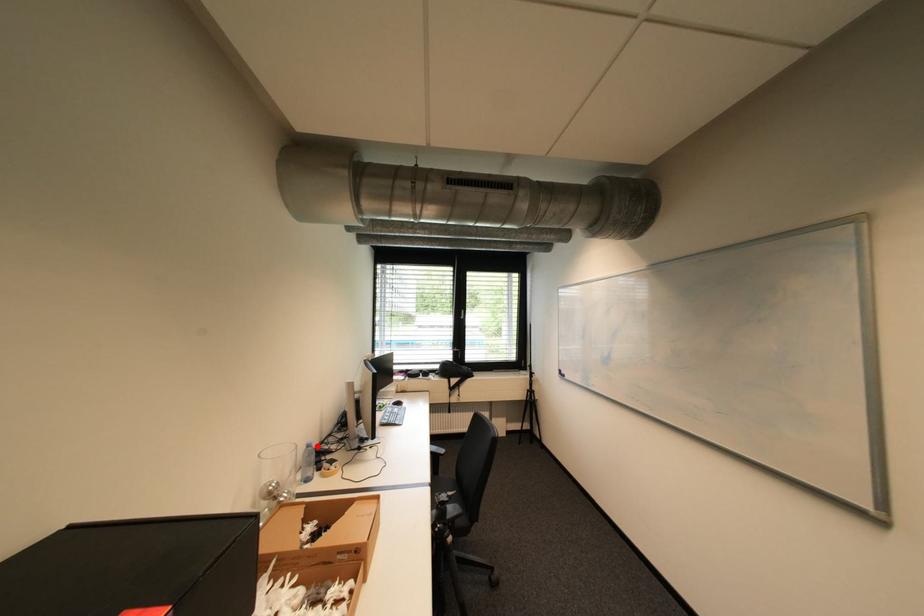
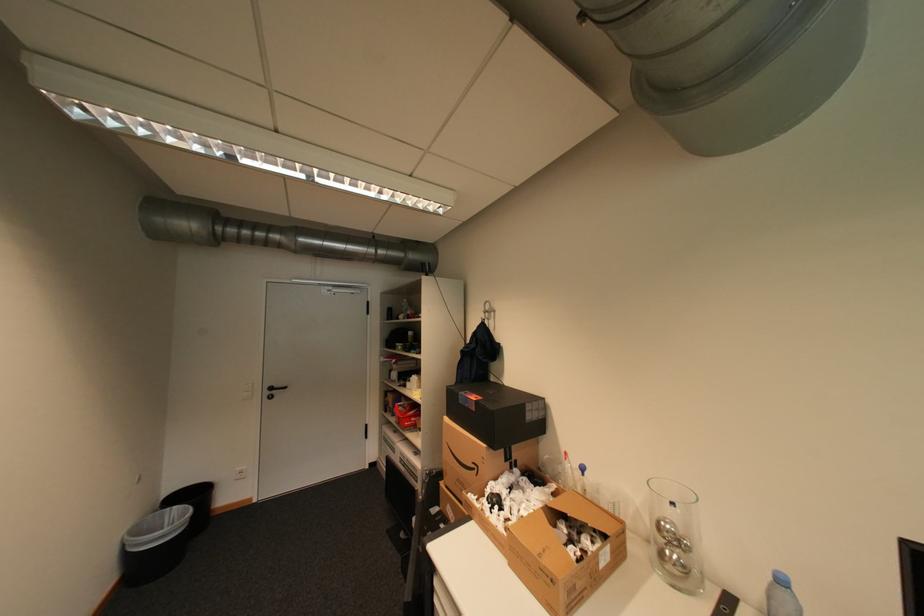
Question: I am providing you with two images of the same scene from different viewpoints. A red point is marked on the first image. At the location where the point appears in image 1, is it still visible in image 2?

Choices:
 (A) Yes
 (B) No

Answer: (A)